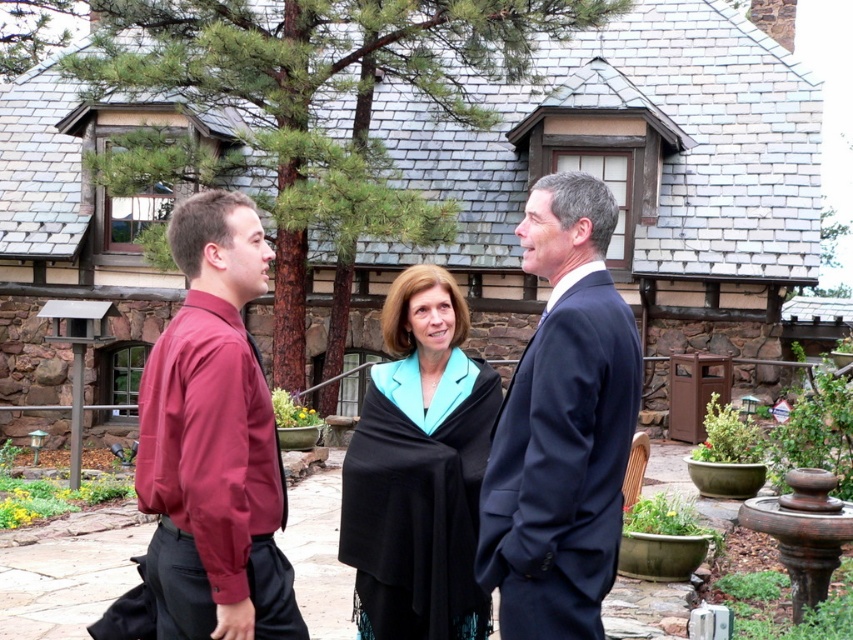
Between point (564, 320) and point (405, 608), which one is positioned behind?

Point (405, 608)

Does matte black suit at center appear under black woolen shawl at center?

No.

Between point (524, 374) and point (453, 456), which one is positioned in front?

Point (524, 374)

Locate an element on the screen. This screenshot has width=853, height=640. matte black suit at center is located at coordinates (556, 433).

Between maroon fabric shirt at left and black woolen shawl at center, which one appears on the left side from the viewer's perspective?

From the viewer's perspective, maroon fabric shirt at left appears more on the left side.

Which is more to the right, maroon fabric shirt at left or black woolen shawl at center?

Positioned to the right is black woolen shawl at center.

The image size is (853, 640). Describe the element at coordinates (213, 442) in the screenshot. I see `maroon fabric shirt at left` at that location.

Where is `maroon fabric shirt at left`? This screenshot has width=853, height=640. maroon fabric shirt at left is located at coordinates (213, 442).

Does dark blue suit at center have a lesser height compared to maroon fabric shirt at left?

Incorrect, dark blue suit at center's height does not fall short of maroon fabric shirt at left's.

Who is more distant from viewer, (x=590, y=582) or (x=171, y=230)?

Point (x=171, y=230)

Which is in front, point (578, 467) or point (199, 564)?

Positioned in front is point (199, 564).

Identify the location of dark blue suit at center. This screenshot has width=853, height=640. (561, 426).